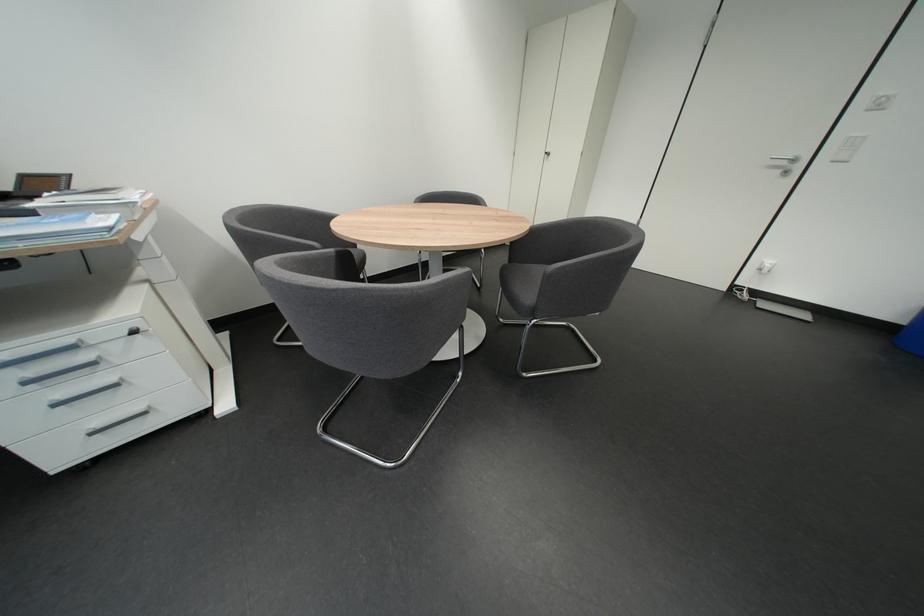
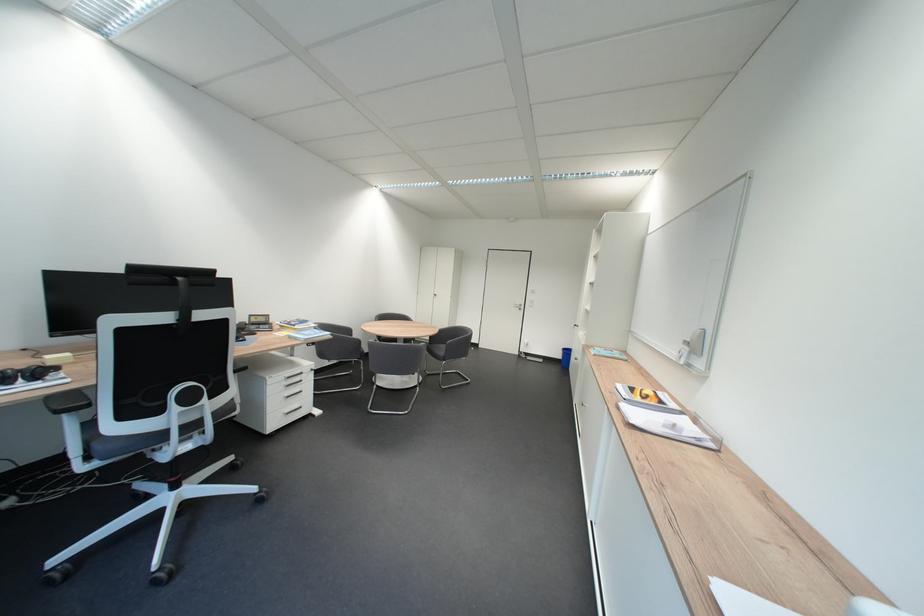
Locate, in the second image, the point that corresponds to pixel 776 306 in the first image.

(541, 360)